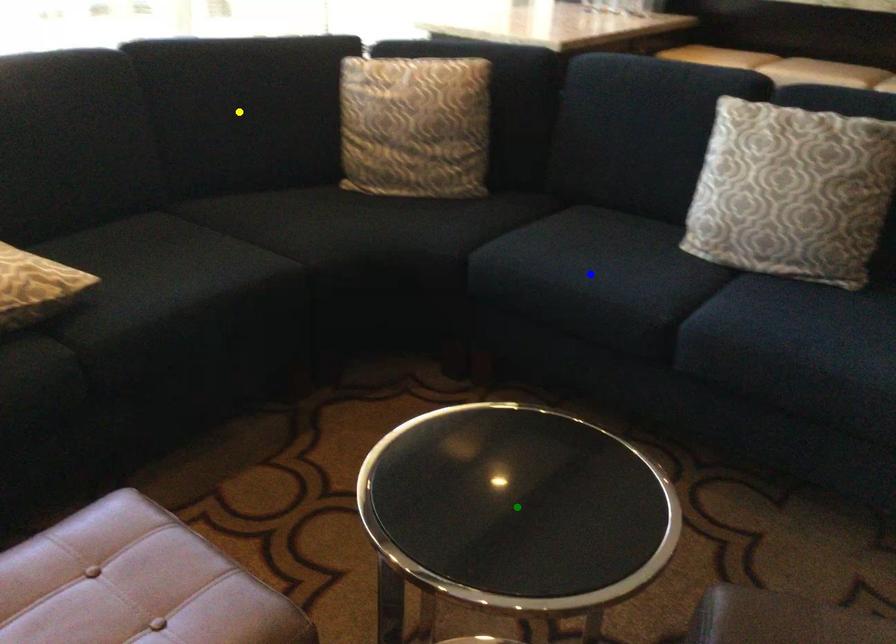
Order these from nearest to farthest:
green point
yellow point
blue point

green point → blue point → yellow point